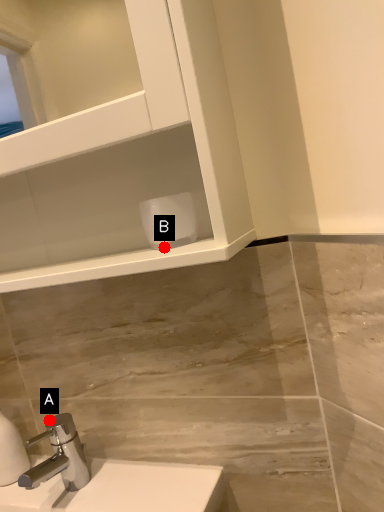
Question: Two points are circled on the image, labeled by A and B beside each circle. Which point is farther to the camera?

Choices:
 (A) A is further
 (B) B is further

Answer: (A)